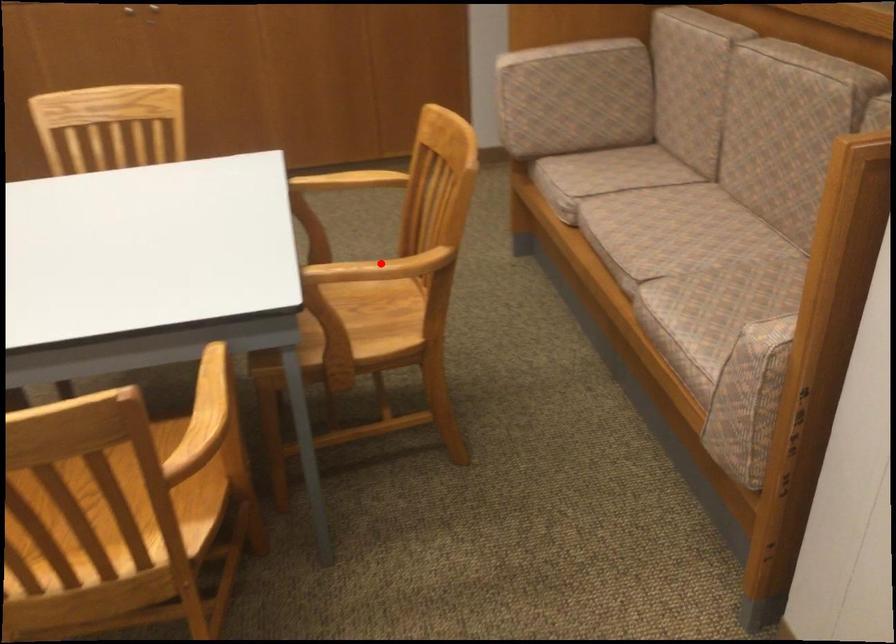
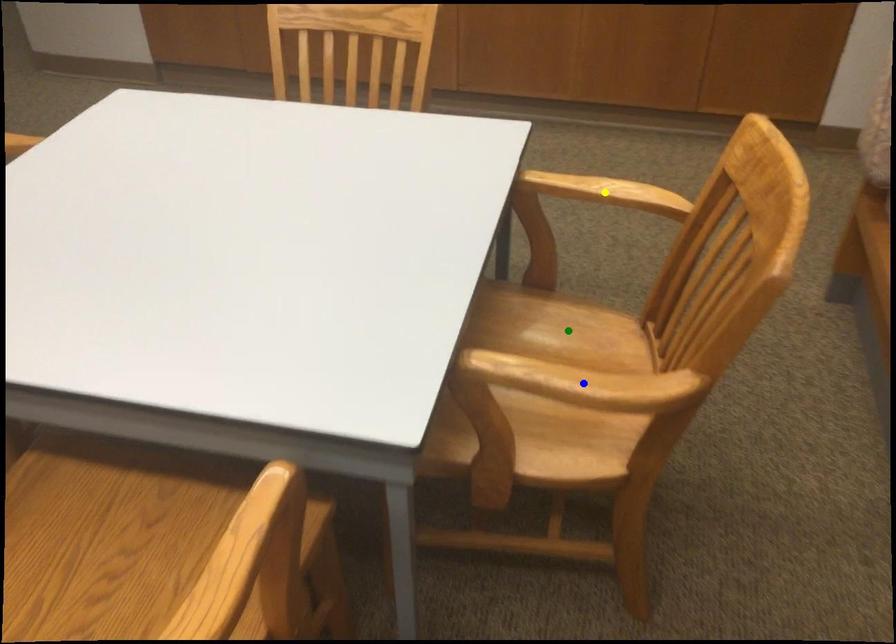
Question: I am providing you with two images of the same scene from different viewpoints. A red point is marked on the first image. You are given multiple points on the second image. In image 2, which mark is for the same physical point as the one in image 1?

Choices:
 (A) yellow point
 (B) green point
 (C) blue point

Answer: (C)